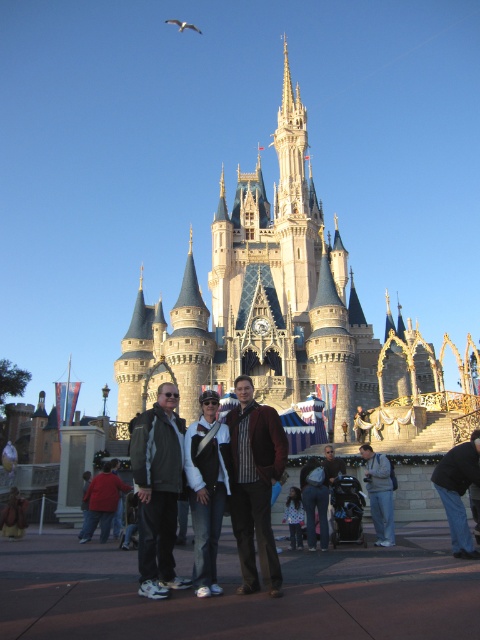
You are standing in front of the castle and notice two jackets. The brown leather jacket at center and the red jacket at lower left. Which jacket is positioned higher relative to the other?

The brown leather jacket at center is located above the red jacket at lower left, so it is positioned higher.

You are a photographer trying to capture a group photo of the dark gray jacket at center and jeans at center. If you want to ensure both subjects are in focus, which one should you adjust the camera focus to prioritize based on their positions?

The dark gray jacket at center might be wider than jeans at center, so you should adjust the camera focus to prioritize the wider subject to ensure both are in focus.

You are a photographer taking a group photo in front of the castle. You notice two jackets in the scene. The brown leather jacket at center and the red jacket at lower left. Which jacket is positioned to the right of the other?

The brown leather jacket at center is to the right of the red jacket at lower left.